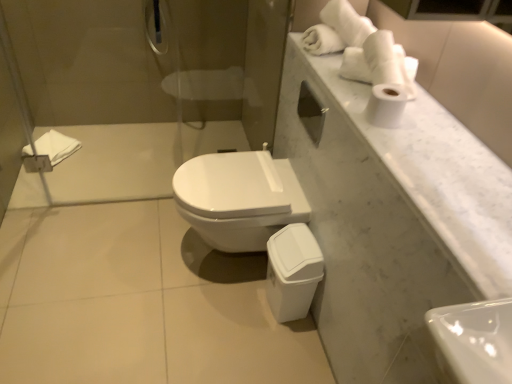
Question: Which is correct: white soft towel at left is inside white marble countertop at upper right, or outside of it?

Choices:
 (A) outside
 (B) inside

Answer: (A)

Question: Is white soft towel at left taller or shorter than white marble countertop at upper right?

Choices:
 (A) short
 (B) tall

Answer: (B)

Question: Which object is positioned farthest from the white glossy toilet at center?

Choices:
 (A) white soft towel at left
 (B) white matte toilet paper at upper right
 (C) white marble countertop at upper right
 (D) glossy metallic showerhead at upper center

Answer: (D)

Question: Which object is positioned farthest from the white glossy toilet at center?

Choices:
 (A) glossy metallic showerhead at upper center
 (B) white soft towel at left
 (C) white marble countertop at upper right
 (D) white matte toilet paper at upper right

Answer: (A)